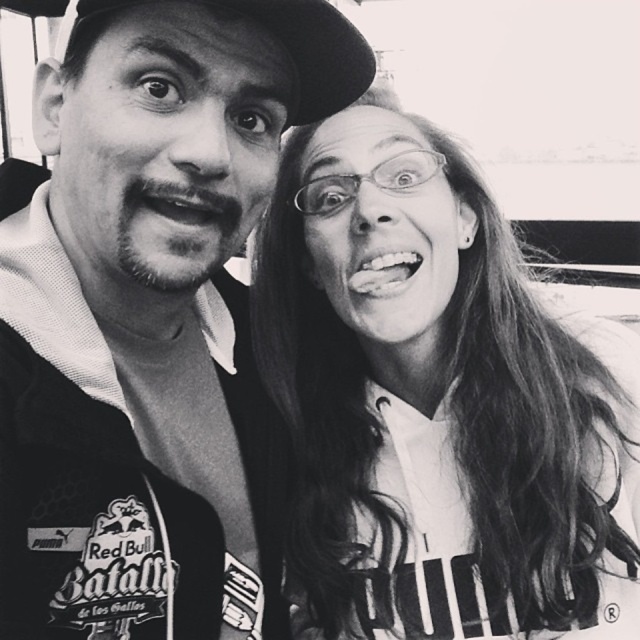
In the image, there is a point labeled as point (436, 403). What object is located at this point?

The smooth white shirt at upper right is located at point (436, 403).

From the picture: Looking at the two items in the scene, the smooth white shirt at upper right and the black fabric baseball hat at upper center, which one is positioned to the right of the other?

The smooth white shirt at upper right is positioned to the right of the black fabric baseball hat at upper center.